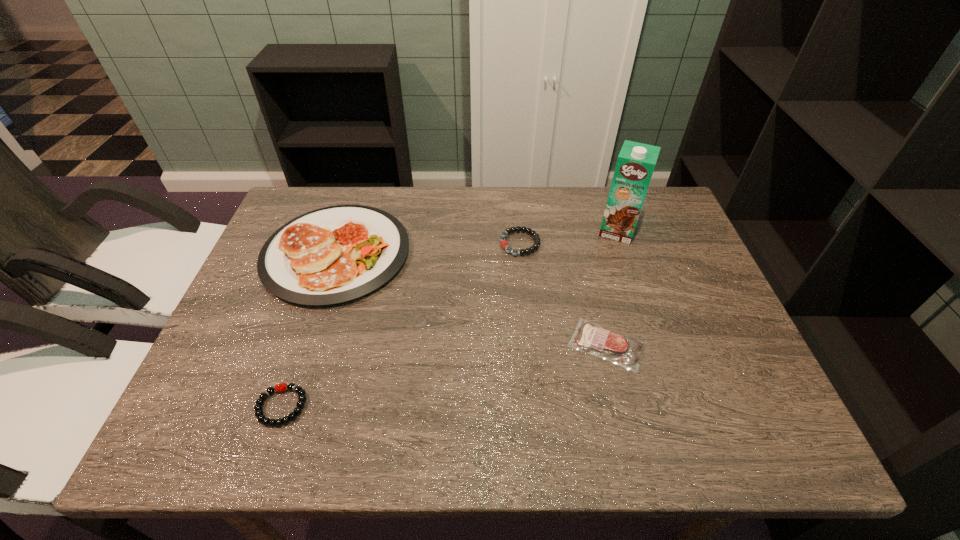
Identify the location of vacant position located 0.220m on the back of the steak. (586, 256).

Image resolution: width=960 pixels, height=540 pixels. In order to click on vacant space situated 0.100m on the right of the nearer bracelet in this screenshot , I will do `click(354, 406)`.

What are the coordinates of `carton that is at the far edge` in the screenshot? It's located at point(636,161).

At what (x,y) coordinates should I click in order to perform the action: click on dish located in the far edge section of the desktop. Please return your answer as a coordinate pair (x, y). Image resolution: width=960 pixels, height=540 pixels. Looking at the image, I should click on (332, 255).

This screenshot has width=960, height=540. In order to click on bracelet that is at the far edge in this screenshot , I will do `click(504, 244)`.

Where is `object that is at the near edge`? This screenshot has width=960, height=540. object that is at the near edge is located at coordinates (300, 404).

Locate an element on the screen. dish that is at the left edge is located at coordinates (332, 255).

Locate an element on the screen. The width and height of the screenshot is (960, 540). bracelet at the left edge is located at coordinates (300, 404).

At what (x,y) coordinates should I click in order to perform the action: click on object that is positioned at the right edge. Please return your answer as a coordinate pair (x, y). The width and height of the screenshot is (960, 540). Looking at the image, I should click on (636, 161).

This screenshot has height=540, width=960. I want to click on object that is positioned at the far left corner, so click(x=332, y=255).